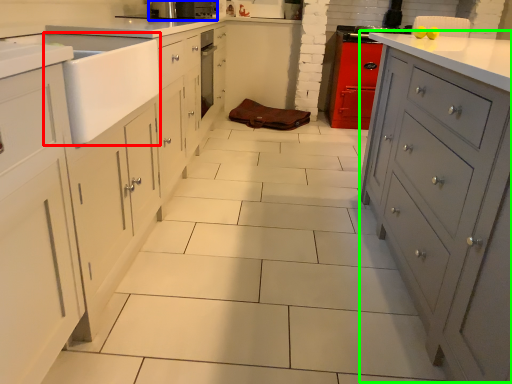
Question: Estimate the real-world distances between objects in this image. Which object is closer to sink (highlighted by a red box), home appliance (highlighted by a blue box) or file cabinet (highlighted by a green box)?

Choices:
 (A) home appliance
 (B) file cabinet

Answer: (A)